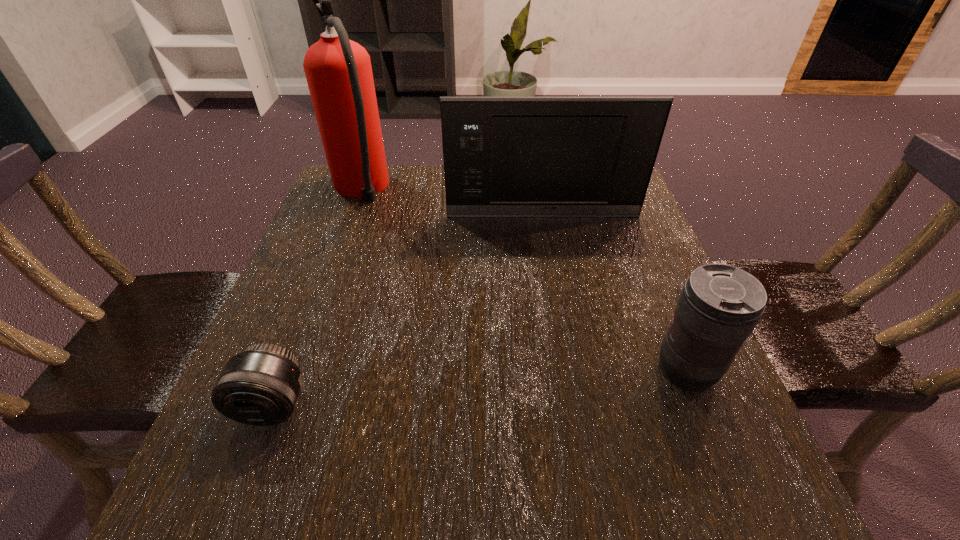
You are a GUI agent. You are given a task and a screenshot of the screen. Output one action in this format:
    pyautogui.click(x=<x>, y=<y>)
    Task: Click on the vacant region located on the front-facing side of the shorter telephoto lens
    The height and width of the screenshot is (540, 960).
    Given the screenshot: What is the action you would take?
    pyautogui.click(x=235, y=504)

The width and height of the screenshot is (960, 540). In order to click on fire extinguisher that is positioned at the far edge in this screenshot , I will do `click(338, 71)`.

Where is `microwave oven that is positioned at the far edge`? The height and width of the screenshot is (540, 960). microwave oven that is positioned at the far edge is located at coordinates (503, 156).

This screenshot has height=540, width=960. I want to click on fire extinguisher located at the left edge, so click(338, 71).

This screenshot has width=960, height=540. In order to click on telephoto lens situated at the left edge in this screenshot , I will do `click(260, 386)`.

Where is `microwave oven positioned at the right edge`? This screenshot has height=540, width=960. microwave oven positioned at the right edge is located at coordinates (503, 156).

This screenshot has width=960, height=540. I want to click on telephoto lens present at the right edge, so click(x=719, y=306).

Identify the location of object that is positioned at the far left corner. The width and height of the screenshot is (960, 540). (338, 71).

Where is `object positioned at the far right corner`? This screenshot has width=960, height=540. object positioned at the far right corner is located at coordinates (503, 156).

Locate an element on the screen. vacant space at the far edge of the desktop is located at coordinates (405, 173).